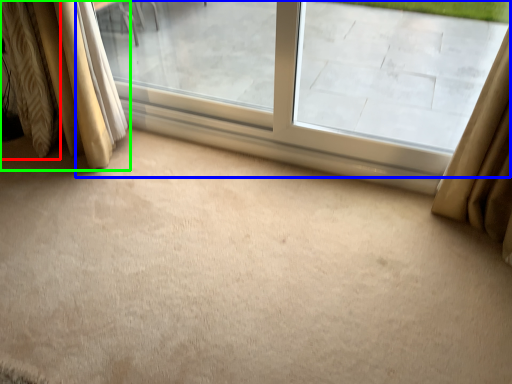
Question: Which object is positioned closest to curtain (highlighted by a red box)? Select from window (highlighted by a blue box) and curtain (highlighted by a green box).

Choices:
 (A) window
 (B) curtain

Answer: (B)